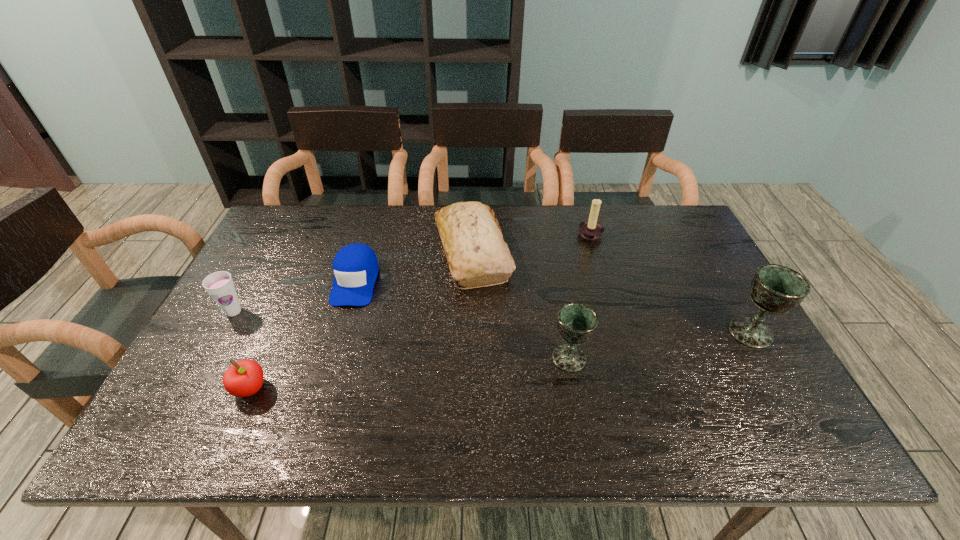
This screenshot has height=540, width=960. In order to click on free space located 0.260m on the left of the right chalice in this screenshot , I will do `click(628, 333)`.

This screenshot has width=960, height=540. In order to click on vacant region located on the wick of the sixth object from left to right in this screenshot , I will do `click(548, 237)`.

Identify the location of vacant region located on the wick of the sixth object from left to right. (533, 237).

I want to click on vacant space located 0.230m on the wick of the sixth object from left to right, so click(508, 237).

I want to click on vacant space located on the front of the leftmost object, so (x=201, y=371).

I want to click on vacant space located 0.050m on the front of the fourth object from left to right, so click(x=471, y=306).

You are a GUI agent. You are given a task and a screenshot of the screen. Output one action in this format:
    pyautogui.click(x=<x>, y=<y>)
    Task: Click on the blank space located on the front-facing side of the fifth object from right to left
    The image size is (960, 540).
    Given the screenshot: What is the action you would take?
    337,342

Where is `vacant space located 0.330m on the right of the second object from left to right`? This screenshot has height=540, width=960. vacant space located 0.330m on the right of the second object from left to right is located at coordinates (411, 388).

In order to click on candle holder situated at the far edge in this screenshot , I will do `click(590, 229)`.

Where is `bread that is at the far edge`? The width and height of the screenshot is (960, 540). bread that is at the far edge is located at coordinates (477, 255).